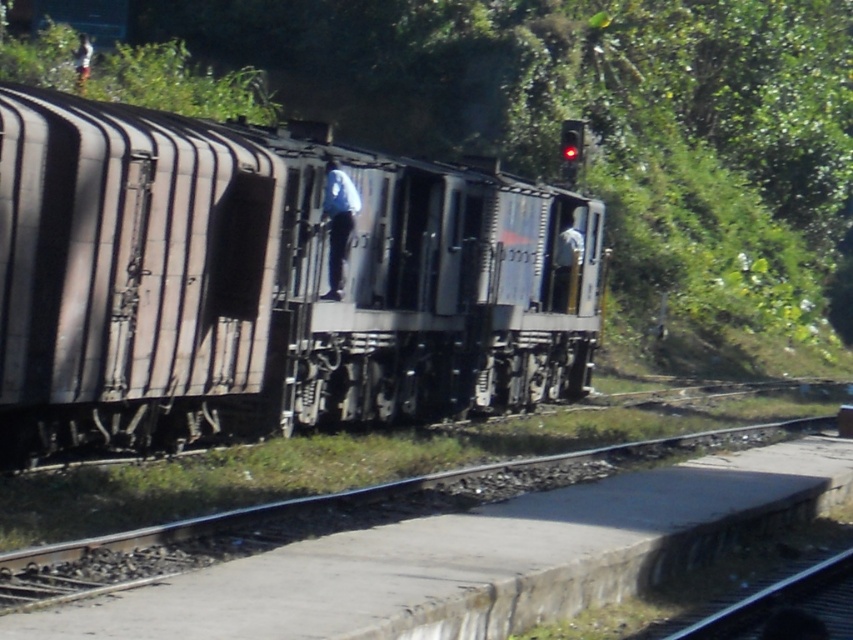
Is rusty metal train at center above smooth concrete platform at lower center?

Yes.

Who is more forward, (7, 195) or (270, 518)?

Point (7, 195)

Find the location of a particular element. The width and height of the screenshot is (853, 640). rusty metal train at center is located at coordinates (263, 284).